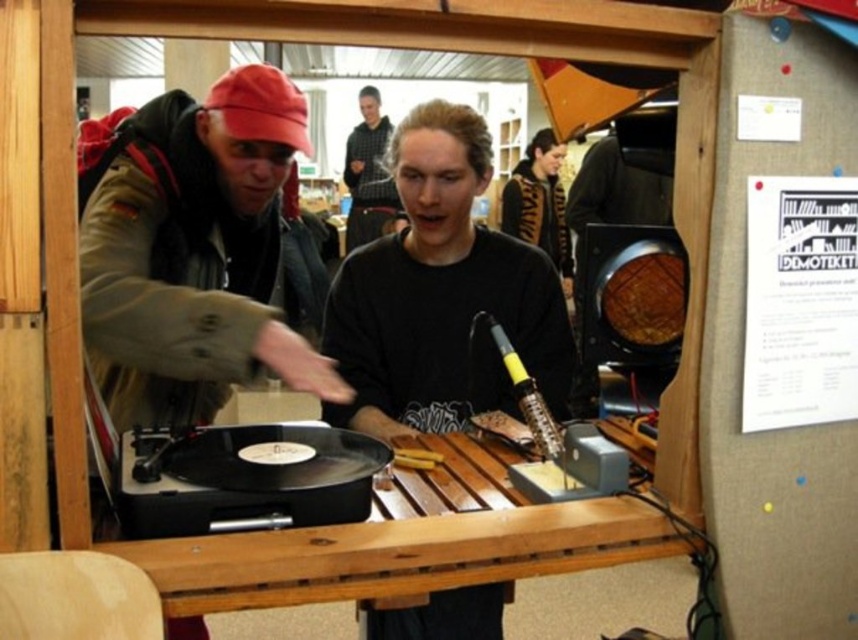
You are standing in front of the table in the workshop. You see two points marked on the table surface. The first point is at coordinates point [493,541] and the second point is at point [533,204]. Which point is closer to you?

Point [493,541] is closer to the camera than point [533,204], so the first point is closer to you.

You are organizing a workshop and need to place a new tool kit on the table. The tool kit requires a space that is not occupied by the black textured sweater at upper center. Where should you place the tool kit on the wooden table at center?

Since the wooden table at center is to the left of the black textured sweater at upper center, you should place the tool kit to the right side of the wooden table at center, away from the sweater.

Based on the photo, you are a delivery person who needs to place a small package between the black textured sweater at upper center and the dark gray hoodie at center. The package is 1 meter long. Will it fit in the space between them?

The distance between the black textured sweater at upper center and the dark gray hoodie at center is 1.09 meters, so the 1 meter long package will fit in the space between them.